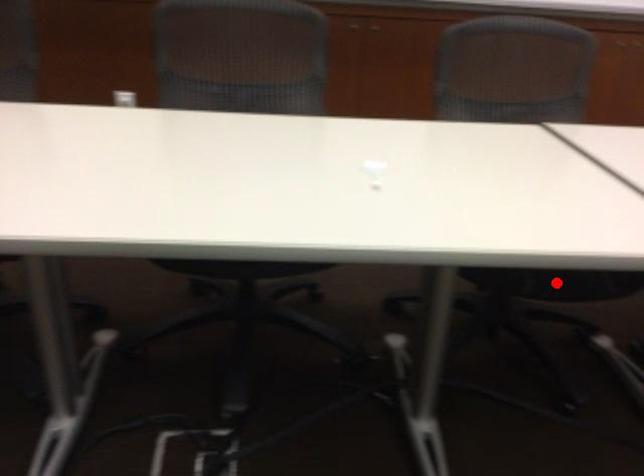
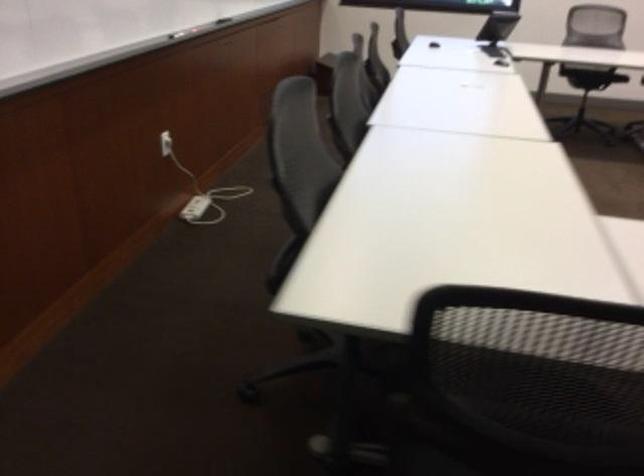
Question: I am providing you with two images of the same scene from different viewpoints. A red point is marked on the first image. At the location where the point appears in image 1, is it still visible in image 2?

Choices:
 (A) Yes
 (B) No

Answer: (B)